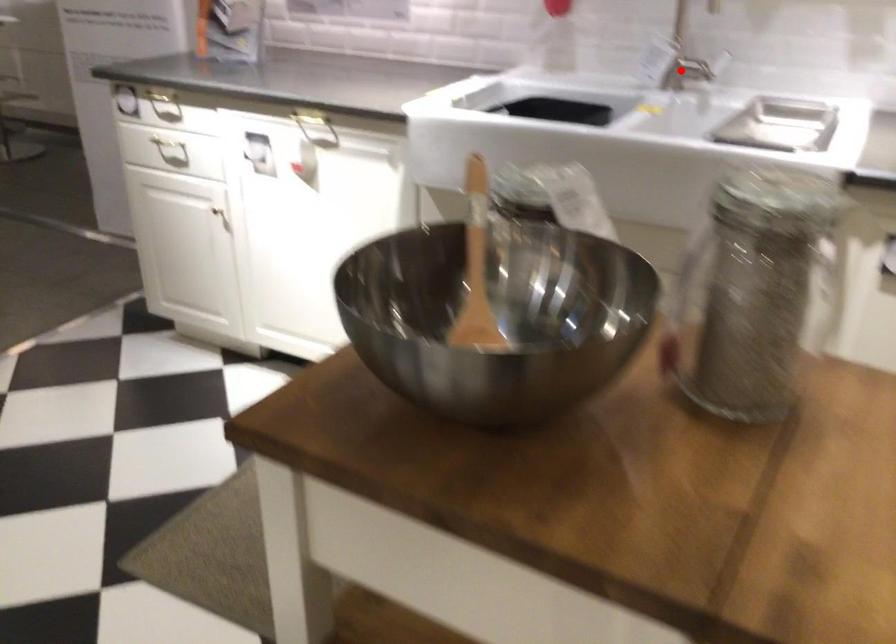
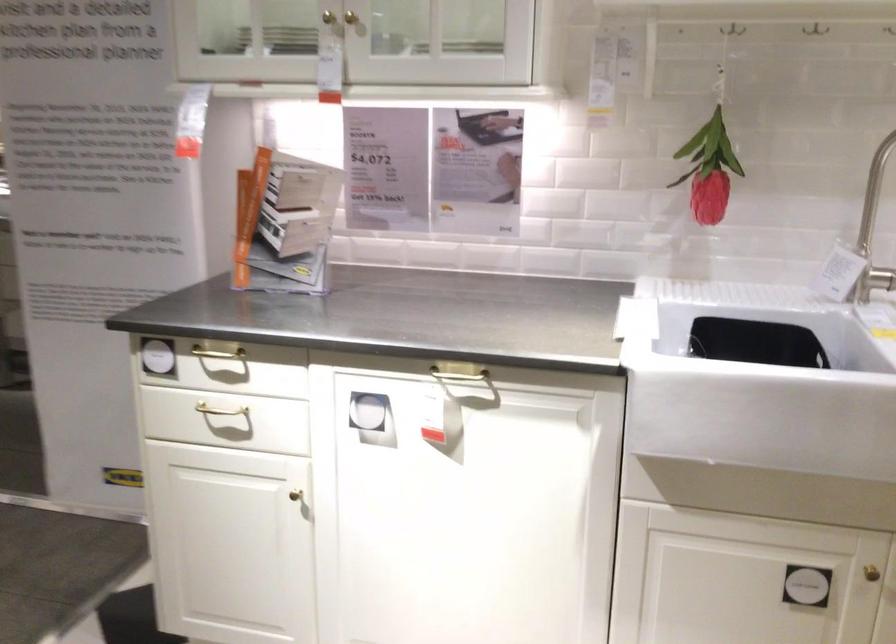
Question: A red point is marked in image1. In image2, is the corresponding 3D point closer to the camera or farther? Reply with the corresponding letter.

Choices:
 (A) The corresponding 3D point is closer.
 (B) The corresponding 3D point is farther.

Answer: (A)